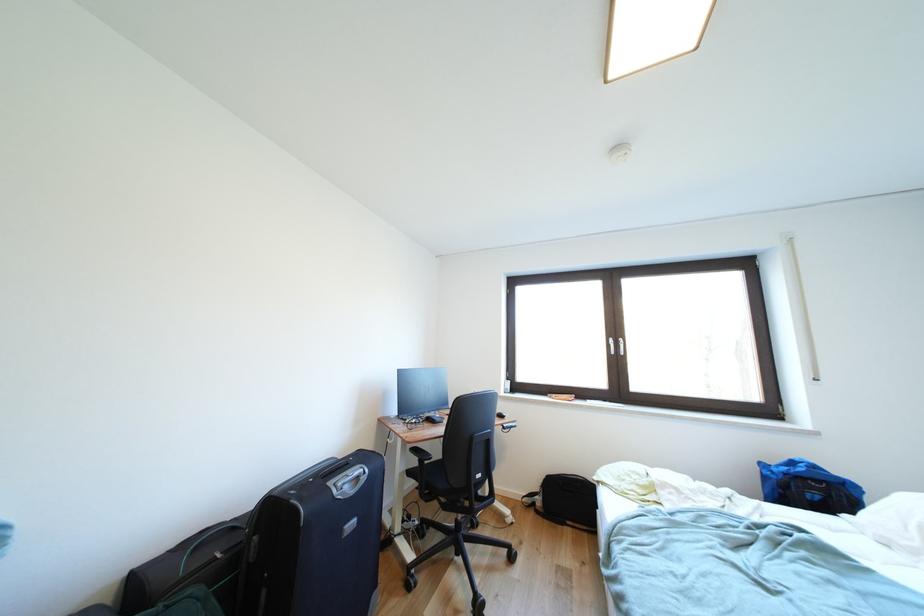
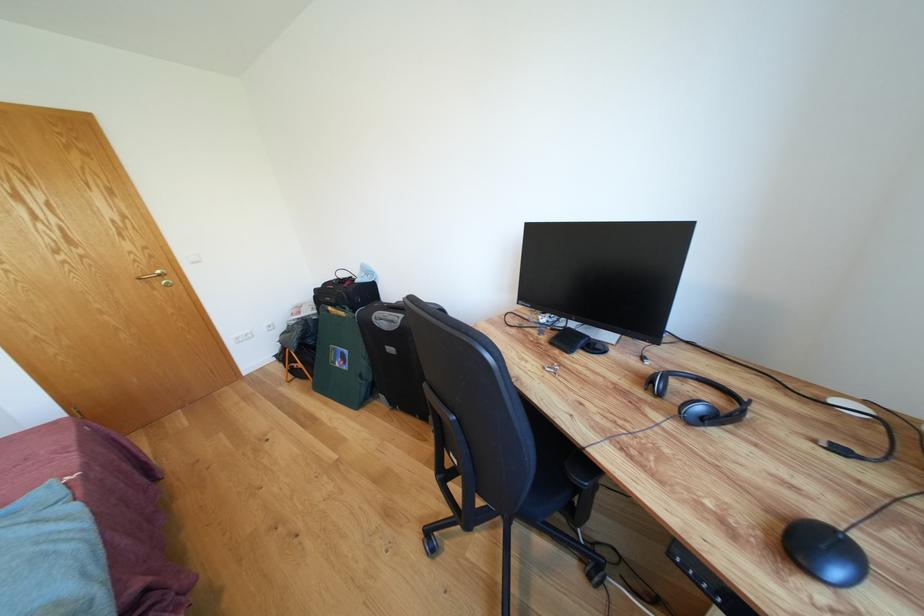
Find the pixel in the second image that matches (365,477) in the first image.

(398, 322)